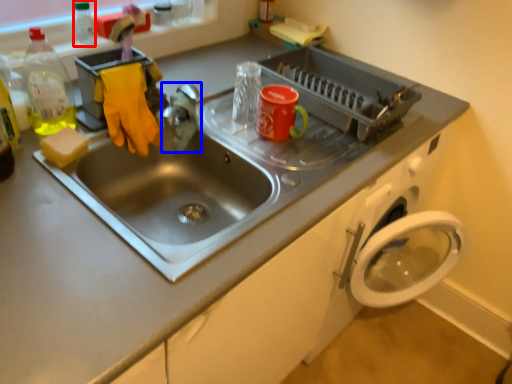
Question: Which point is closer to the camera, bottle (highlighted by a red box) or faucet (highlighted by a blue box)?

Choices:
 (A) bottle
 (B) faucet

Answer: (B)